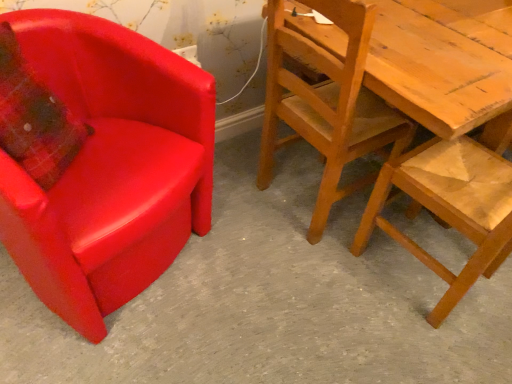
Locate an element on the screen. This screenshot has height=384, width=512. free space between wooden chair at right, positioned as the 2th chair in right-to-left order, and wooden textured chair at right, which ranks as the third chair in left-to-right order is located at coordinates (367, 264).